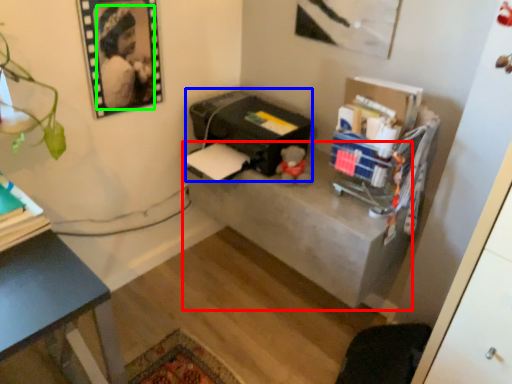
Question: Which object is positioned closest to table (highlighted by a red box)? Select from printer (highlighted by a blue box) and person (highlighted by a green box).

Choices:
 (A) printer
 (B) person

Answer: (A)